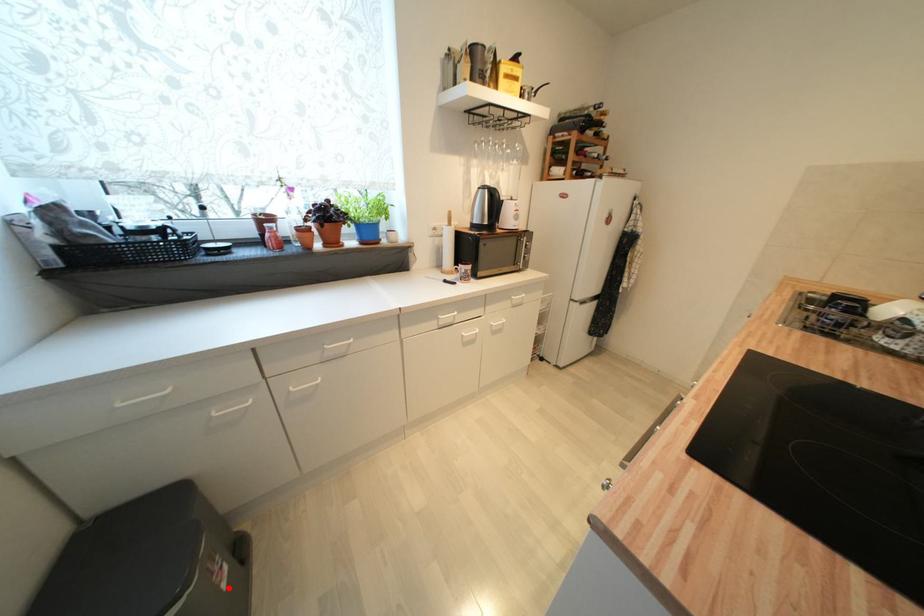
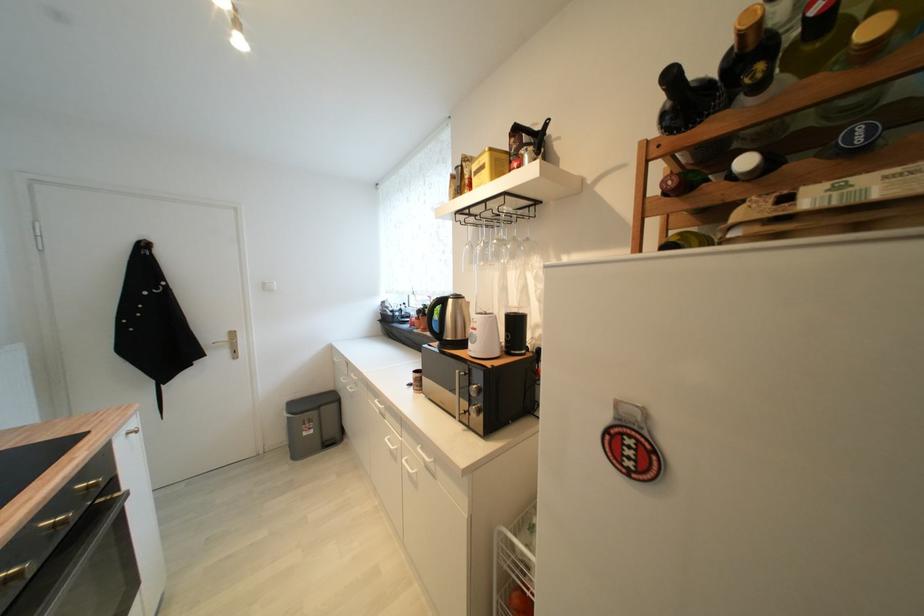
Question: I am providing you with two images of the same scene from different viewpoints. A red point is shown in image1. For the corresponding object point in image2, is it positioned nearer or farther from the camera?

Choices:
 (A) Nearer
 (B) Farther

Answer: (A)